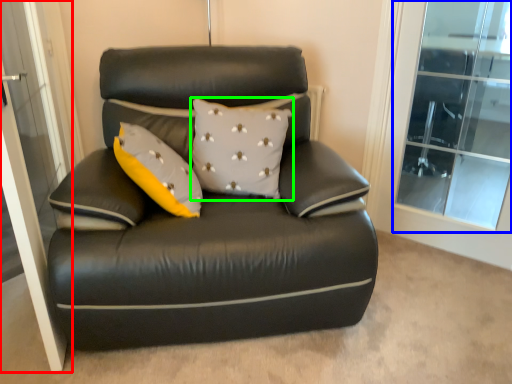
Question: Which object is positioned farthest from screen door (highlighted by a red box)? Select from window (highlighted by a blue box) and pillow (highlighted by a green box).

Choices:
 (A) window
 (B) pillow

Answer: (A)